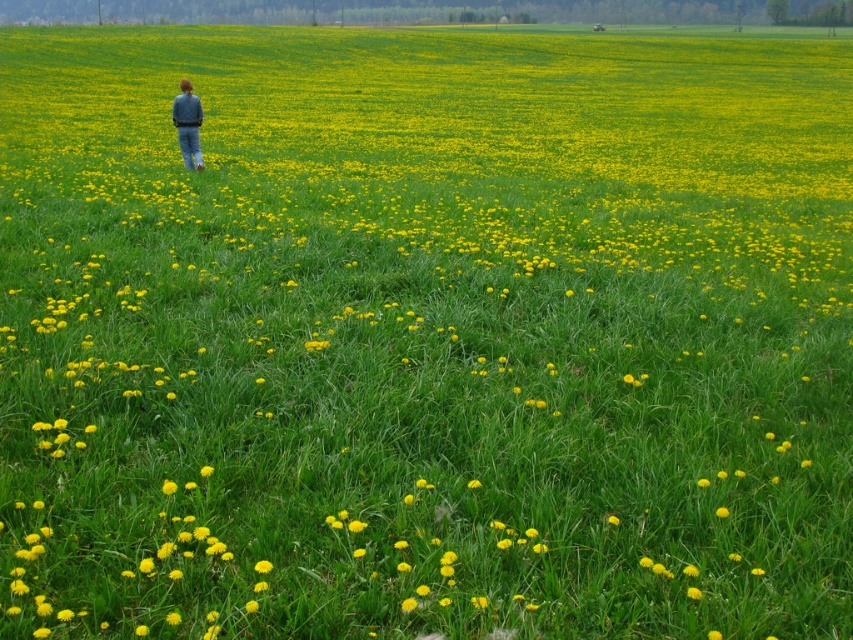
You are standing at the center of the field and see the denim jacket at upper left. Which direction should you walk to reach it?

The denim jacket at upper left is located at point (189, 124), which is to the left and slightly forward from your current position at the center. You should walk towards the left and slightly forward to reach it.

You are standing in the open field and see the denim jacket at upper left and the yellow matte flower at center. Which object is closer to the left edge of the frame?

The denim jacket at upper left is closer to the left edge of the frame because it is positioned to the left of the yellow matte flower at center.

You are standing in the open field and see the denim jacket at upper left and the yellow matte flower at center. Which object is taller?

The denim jacket at upper left is much taller than the yellow matte flower at center.